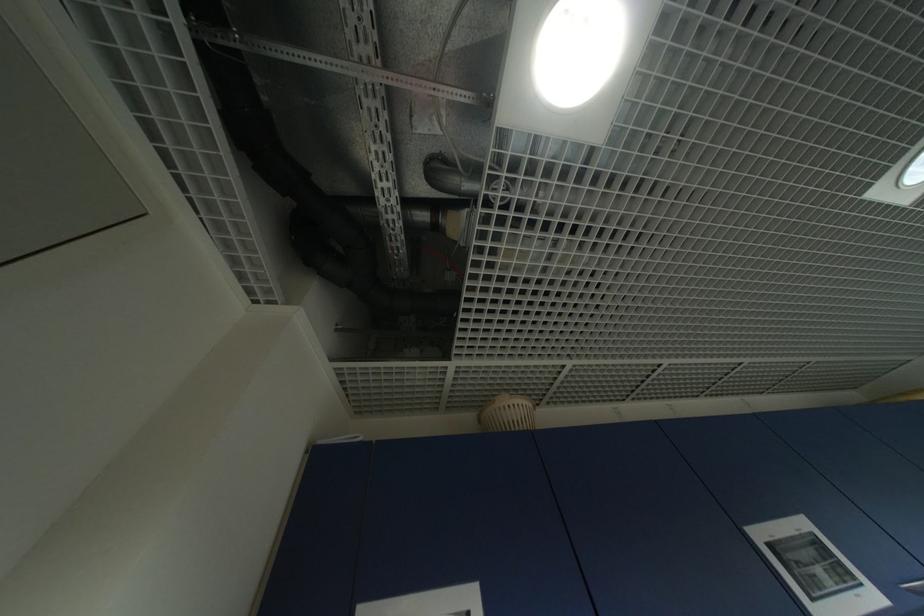
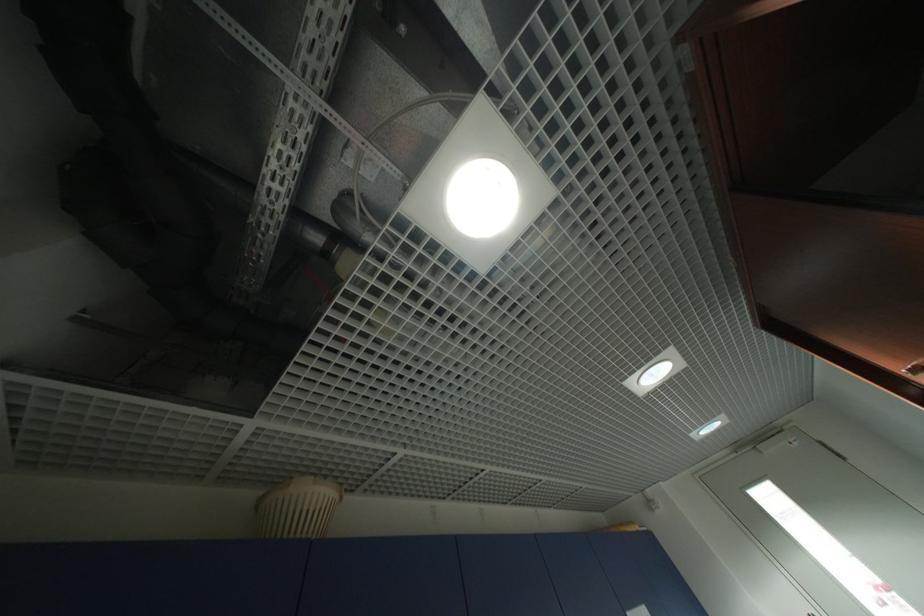
How did the camera likely rotate?

The camera rotated toward right-up.